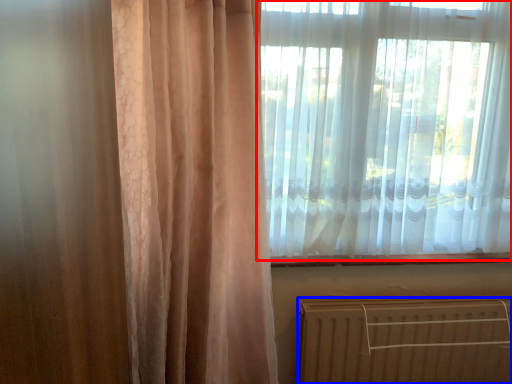
Question: Among these objects, which one is farthest to the camera, curtain (highlighted by a red box) or radiator (highlighted by a blue box)?

Choices:
 (A) curtain
 (B) radiator

Answer: (B)